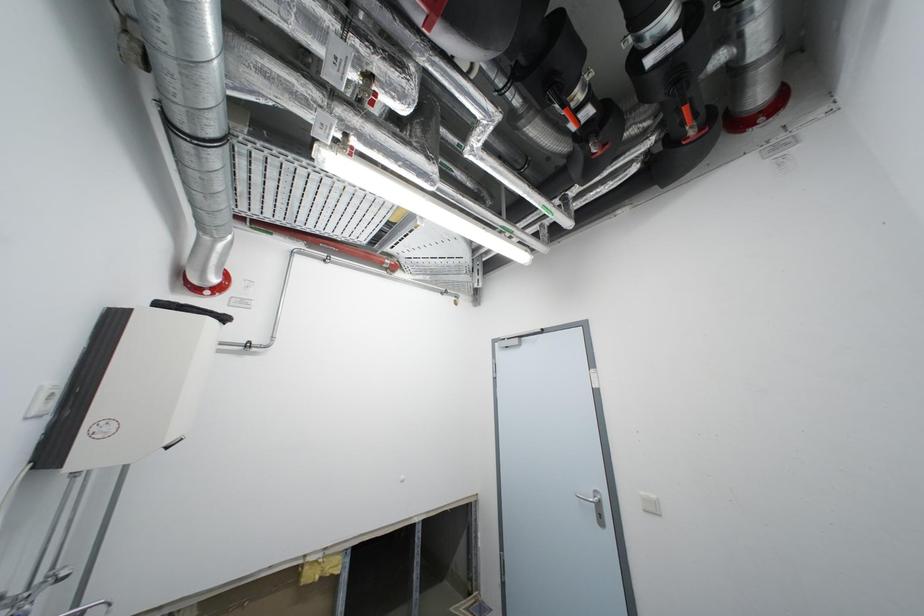
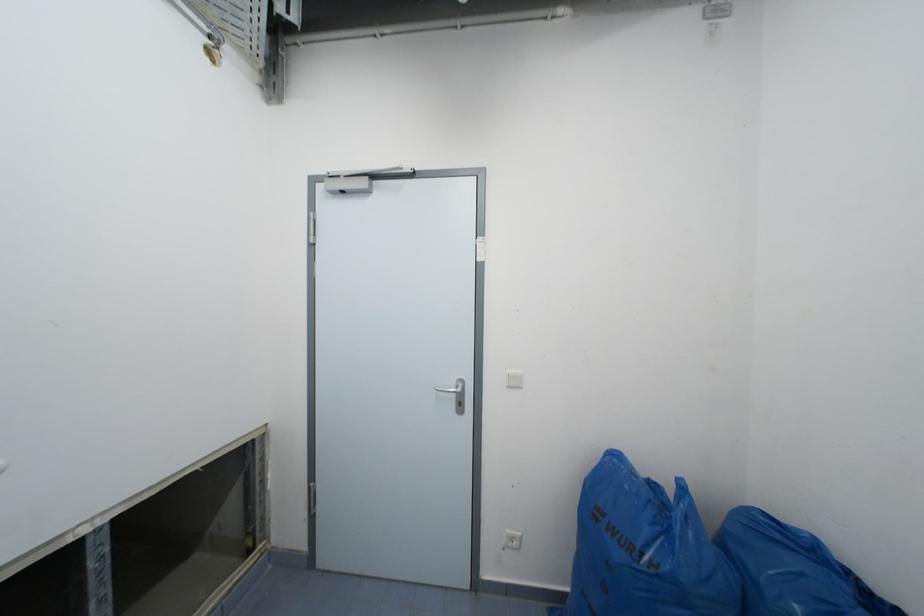
Question: The first image is from the beginning of the video and the second image is from the end. How did the camera likely rotate when shooting the video?

Choices:
 (A) Left
 (B) Right
 (C) Up
 (D) Down

Answer: (B)